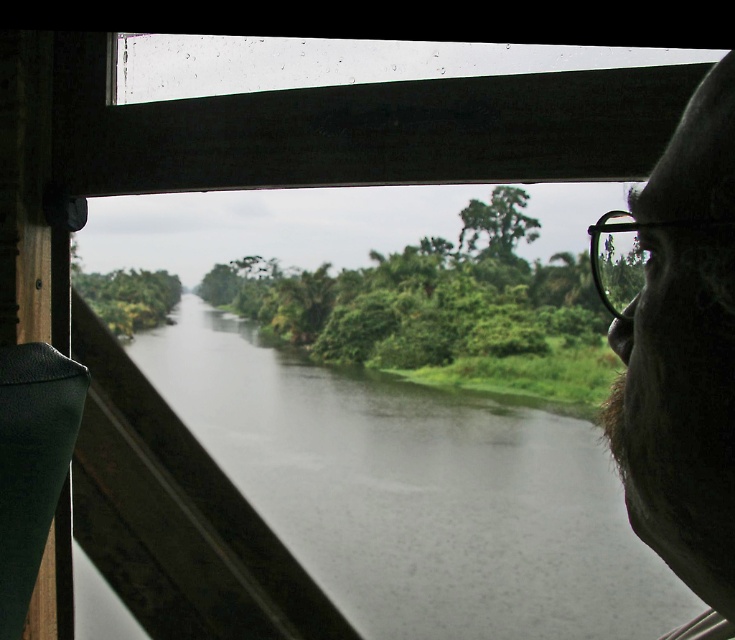
You are on a boat and want to know the exact position of the dark gray water at center in the image. What are its coordinates?

The dark gray water at center is located at coordinates (415, 493).

You are an animal observer on a boat and notice two features in the scene. The dark gray water at center and the dark brown fur at right. Which one appears wider from your current viewpoint?

The dark gray water at center appears wider than the dark brown fur at right because its width is larger according to the description.

You are standing on the deck of the boat and want to pour a drink into the dark gray water at center. If your arm can reach 1.6 meters, will you be able to reach the water?

The dark gray water at center is 1.71 meters away from the viewer. Since your arm can only reach 1.6 meters, you will not be able to reach the water.